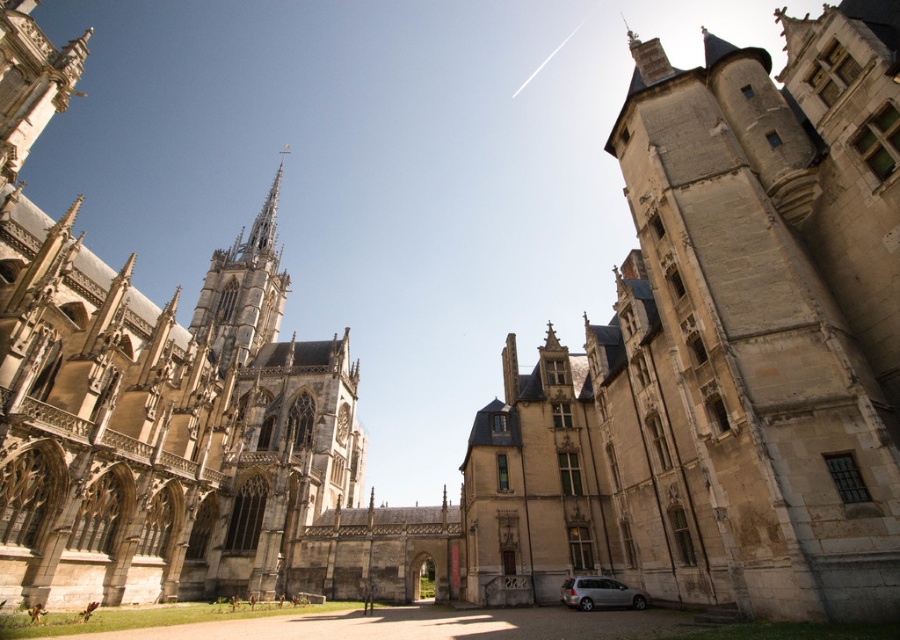
Can you confirm if stone gothic cathedral at left is positioned below silver metallic van at lower center?

Incorrect, stone gothic cathedral at left is not positioned below silver metallic van at lower center.

Which is more to the left, stone gothic cathedral at left or silver metallic van at lower center?

stone gothic cathedral at left is more to the left.

I want to click on stone gothic cathedral at left, so click(148, 396).

Is stone castle at center positioned at the back of stone spire at upper left?

No.

Is stone castle at center to the right of stone spire at upper left from the viewer's perspective?

Correct, you'll find stone castle at center to the right of stone spire at upper left.

Identify the location of stone castle at center. The height and width of the screenshot is (640, 900). (723, 349).

Who is more distant from viewer, (462, 483) or (626, 604)?

The point (462, 483) is behind.

In the scene shown: Which of these two, stone castle at center or silver metallic van at lower center, stands shorter?

Standing shorter between the two is silver metallic van at lower center.

Is point (861, 100) positioned in front of point (630, 596)?

Yes, point (861, 100) is in front of point (630, 596).

You are a GUI agent. You are given a task and a screenshot of the screen. Output one action in this format:
    pyautogui.click(x=<x>, y=<y>)
    Task: Click on the stone castle at center
    This screenshot has height=640, width=900.
    Given the screenshot: What is the action you would take?
    pyautogui.click(x=723, y=349)